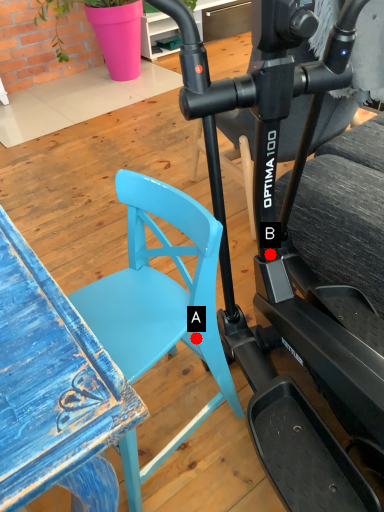
Question: Two points are circled on the image, labeled by A and B beside each circle. Which point is closer to the camera?

Choices:
 (A) A is closer
 (B) B is closer

Answer: (A)